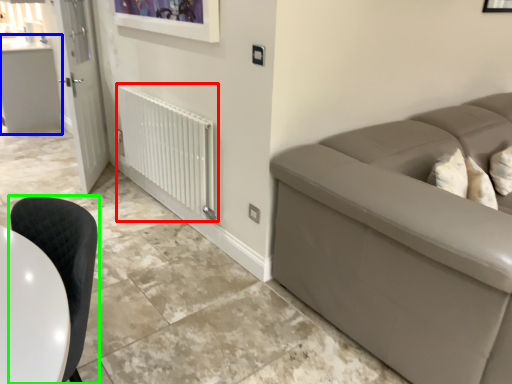
Question: Which object is the closest to the radiator (highlighted by a red box)? Choose among these: counter top (highlighted by a blue box) or chair (highlighted by a green box).

Choices:
 (A) counter top
 (B) chair

Answer: (B)